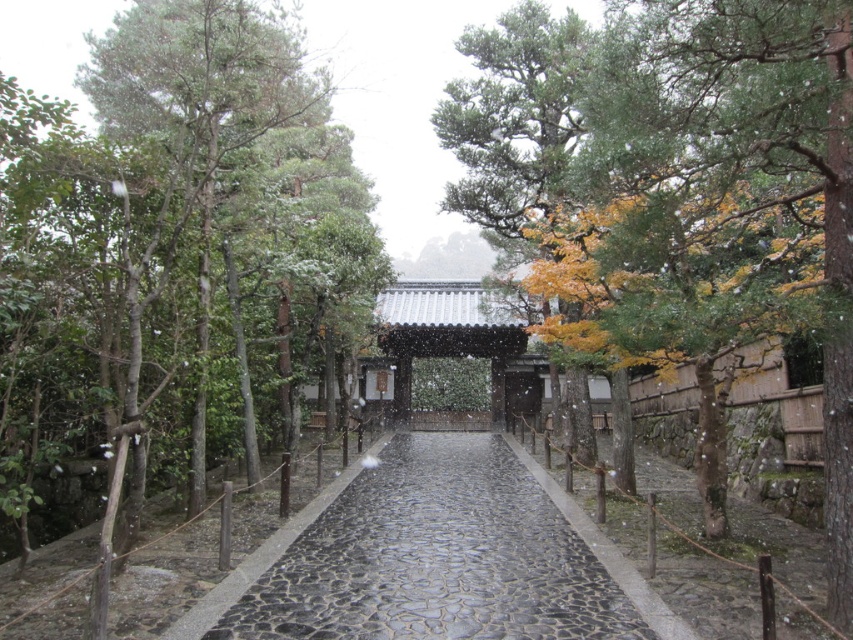
You are standing at the entrance of the temple pathway and see a point marked at coordinates [732,179]. Based on the scene description, can you determine what this point is located on?

The point at coordinates [732,179] is located on the green textured tree at center.

You are a visitor at the temple and want to take a photo of the green leafy tree at left and the green textured tree at center. Which tree should you stand closer to in order to capture both trees in the frame without moving the camera?

You should stand closer to the green textured tree at center because the green leafy tree at left is taller than the green textured tree at center, so by positioning yourself nearer to the shorter tree, both trees will be more balanced in the camera frame.